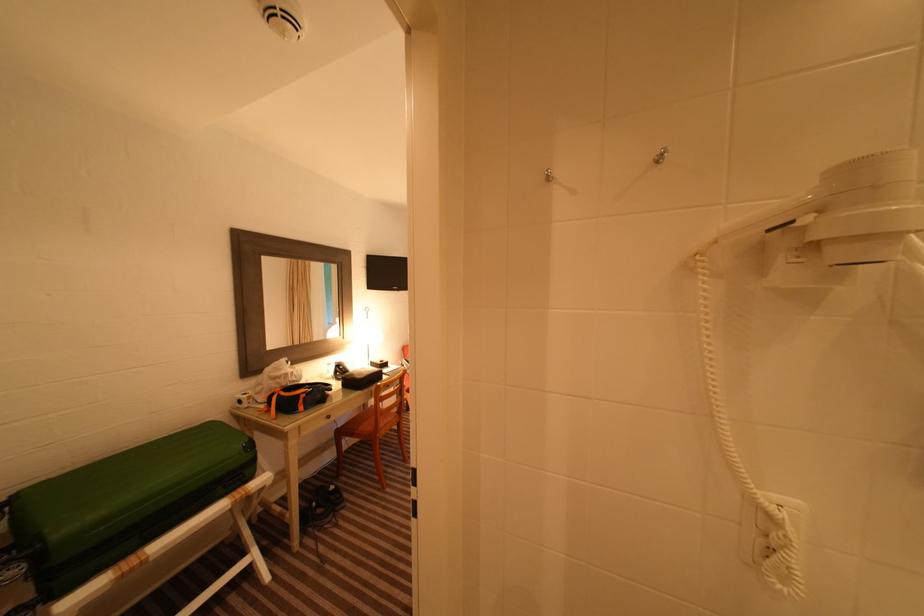
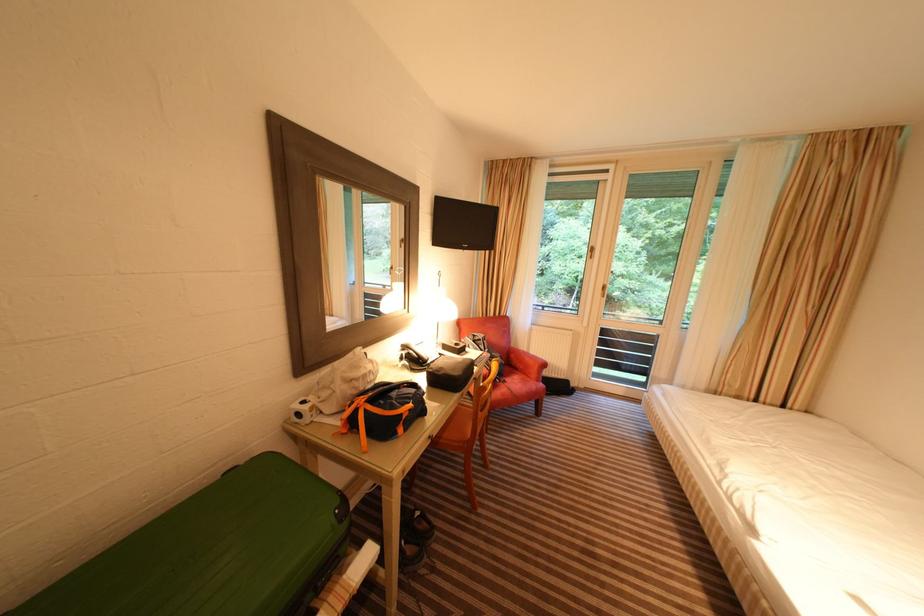
Find the pixel in the second image that matches pixel 285 371 in the first image.

(361, 369)